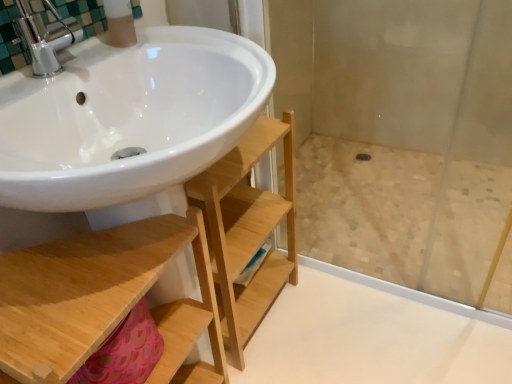
In order to face natural wood shelf at lower left, should I rotate leftwards or rightwards?

It's best to rotate left around 18.274 degrees.

I want to click on transparent glass shower door at center, so 413,108.

From a real-world perspective, which object rests below the other?

transparent glass shower door at center.

Choose the correct answer: Is transparent glass shower door at center inside natural wood shelf at lower left or outside it?

transparent glass shower door at center is not inside natural wood shelf at lower left, it's outside.

Does transparent glass shower door at center have a larger size compared to natural wood shelf at lower left?

Incorrect, transparent glass shower door at center is not larger than natural wood shelf at lower left.

From the picture: Considering the relative positions of transparent glass shower door at center and natural wood shelf at lower left in the image provided, is transparent glass shower door at center to the left of natural wood shelf at lower left from the viewer's perspective?

No.

Looking at this image, does matte plastic soap dispenser at upper left turn towards transparent glass shower door at center?

No, matte plastic soap dispenser at upper left does not turn towards transparent glass shower door at center.

Is matte plastic soap dispenser at upper left taller or shorter than transparent glass shower door at center?

Considering their sizes, matte plastic soap dispenser at upper left has more height than transparent glass shower door at center.

Would you consider matte plastic soap dispenser at upper left to be distant from transparent glass shower door at center?

That's right, there is a large distance between matte plastic soap dispenser at upper left and transparent glass shower door at center.

Looking at this image, is transparent glass shower door at center inside matte plastic soap dispenser at upper left?

Actually, transparent glass shower door at center is outside matte plastic soap dispenser at upper left.

Is natural wood shelf at lower left next to transparent glass shower door at center and touching it?

natural wood shelf at lower left and transparent glass shower door at center are clearly separated.

From the picture: Relative to transparent glass shower door at center, is natural wood shelf at lower left in front or behind?

In the image, natural wood shelf at lower left appears in front of transparent glass shower door at center.

From a real-world perspective, is natural wood shelf at lower left over transparent glass shower door at center?

Yes, from a real-world perspective, natural wood shelf at lower left is above transparent glass shower door at center.

Locate an element on the screen. The image size is (512, 384). shower door above the natural wood shelf at lower left (from the image's perspective) is located at coordinates (413, 108).

Considering the positions of objects matte plastic soap dispenser at upper left and natural wood shelf at lower left in the image provided, who is behind, matte plastic soap dispenser at upper left or natural wood shelf at lower left?

matte plastic soap dispenser at upper left.

Is matte plastic soap dispenser at upper left bigger than natural wood shelf at lower left?

No, matte plastic soap dispenser at upper left is not bigger than natural wood shelf at lower left.

Can you see matte plastic soap dispenser at upper left touching natural wood shelf at lower left?

No, matte plastic soap dispenser at upper left is not with natural wood shelf at lower left.

How much distance is there between matte plastic soap dispenser at upper left and natural wood shelf at lower left?

matte plastic soap dispenser at upper left is 51.49 centimeters from natural wood shelf at lower left.

Is natural wood shelf at lower left looking in the opposite direction of matte plastic soap dispenser at upper left?

That's not correct — natural wood shelf at lower left is not looking away from matte plastic soap dispenser at upper left.

Can you confirm if natural wood shelf at lower left is smaller than matte plastic soap dispenser at upper left?

Incorrect, natural wood shelf at lower left is not smaller in size than matte plastic soap dispenser at upper left.

Can you see transparent glass shower door at center touching matte plastic soap dispenser at upper left?

No, transparent glass shower door at center is not in contact with matte plastic soap dispenser at upper left.

From a real-world perspective, is transparent glass shower door at center above or below matte plastic soap dispenser at upper left?

From a real-world perspective, transparent glass shower door at center is physically below matte plastic soap dispenser at upper left.

Is transparent glass shower door at center oriented away from matte plastic soap dispenser at upper left?

No, transparent glass shower door at center's orientation is not away from matte plastic soap dispenser at upper left.

From the image's perspective, which is above, transparent glass shower door at center or matte plastic soap dispenser at upper left?

matte plastic soap dispenser at upper left appears higher in the image.

This screenshot has height=384, width=512. Find the location of `shelf that is above the transparent glass shower door at center (from a real-world perspective)`. shelf that is above the transparent glass shower door at center (from a real-world perspective) is located at coordinates (116, 290).

You are a GUI agent. You are given a task and a screenshot of the screen. Output one action in this format:
    pyautogui.click(x=<x>, y=<y>)
    Task: Click on the toiletry located above the transparent glass shower door at center (from the image's perspective)
    The width and height of the screenshot is (512, 384).
    Given the screenshot: What is the action you would take?
    pyautogui.click(x=120, y=23)

Considering their positions, is transparent glass shower door at center positioned closer to matte plastic soap dispenser at upper left than natural wood shelf at lower left?

natural wood shelf at lower left.

Which object lies further to the anchor point natural wood shelf at lower left, matte plastic soap dispenser at upper left or transparent glass shower door at center?

Based on the image, transparent glass shower door at center appears to be further to natural wood shelf at lower left.

Which object lies further to the anchor point natural wood shelf at lower left, transparent glass shower door at center or matte plastic soap dispenser at upper left?

transparent glass shower door at center.

Considering their positions, is matte plastic soap dispenser at upper left positioned closer to transparent glass shower door at center than natural wood shelf at lower left?

natural wood shelf at lower left.

Estimate the real-world distances between objects in this image. Which object is further from matte plastic soap dispenser at upper left, natural wood shelf at lower left or transparent glass shower door at center?

Among the two, transparent glass shower door at center is located further to matte plastic soap dispenser at upper left.

From the picture: Based on their spatial positions, is natural wood shelf at lower left or matte plastic soap dispenser at upper left further from transparent glass shower door at center?

matte plastic soap dispenser at upper left is further to transparent glass shower door at center.

Locate an element on the screen. The image size is (512, 384). toiletry between natural wood shelf at lower left and transparent glass shower door at center from left to right is located at coordinates (120, 23).